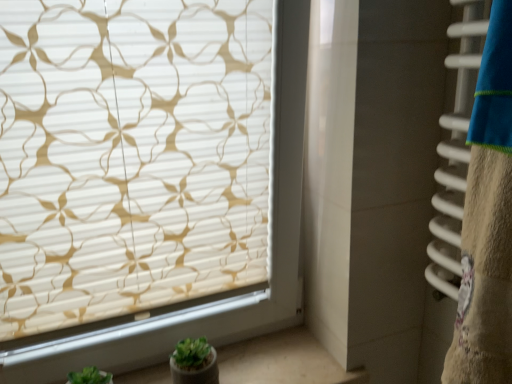
Question: Considering the positions of white smooth window sill at lower left and white textured blind at upper left in the image, is white smooth window sill at lower left taller or shorter than white textured blind at upper left?

Choices:
 (A) tall
 (B) short

Answer: (B)

Question: From the image's perspective, is white smooth window sill at lower left above or below white textured blind at upper left?

Choices:
 (A) below
 (B) above

Answer: (A)

Question: Is point (280, 354) positioned closer to the camera than point (125, 1)?

Choices:
 (A) closer
 (B) farther

Answer: (B)

Question: Is white textured blind at upper left in front of or behind white smooth window sill at lower left in the image?

Choices:
 (A) behind
 (B) front

Answer: (B)

Question: Does point 147,281 appear closer or farther from the camera than point 218,360?

Choices:
 (A) closer
 (B) farther

Answer: (A)

Question: Looking at the image, does white textured blind at upper left seem bigger or smaller compared to white smooth window sill at lower left?

Choices:
 (A) small
 (B) big

Answer: (B)

Question: Considering the relative positions of white textured blind at upper left and white smooth window sill at lower left in the image provided, is white textured blind at upper left to the left or to the right of white smooth window sill at lower left?

Choices:
 (A) left
 (B) right

Answer: (A)